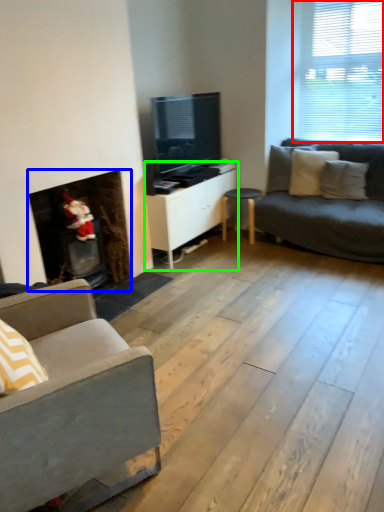
Question: Which object is positioned closest to window (highlighted by a red box)? Select from fireplace (highlighted by a blue box) and cabinetry (highlighted by a green box).

Choices:
 (A) fireplace
 (B) cabinetry

Answer: (B)